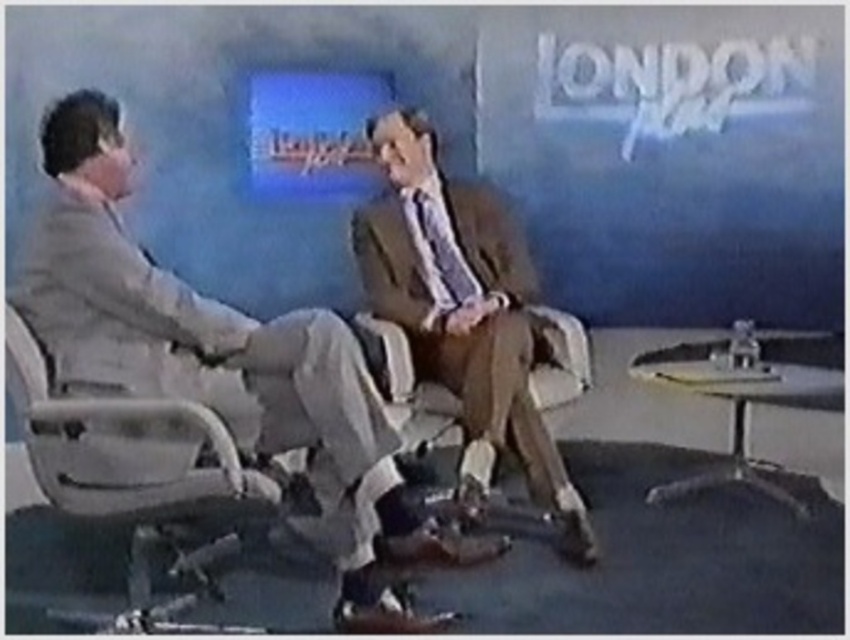
Question: Does brown leather suit at center appear on the left side of light gray plastic swivel chair at left?

Choices:
 (A) no
 (B) yes

Answer: (A)

Question: Considering the relative positions of matte gray suit at center and light gray plastic swivel chair at left in the image provided, where is matte gray suit at center located with respect to light gray plastic swivel chair at left?

Choices:
 (A) above
 (B) below

Answer: (B)

Question: Which object appears farthest from the camera in this image?

Choices:
 (A) brown leather suit at center
 (B) matte gray suit at center
 (C) light gray plastic swivel chair at left

Answer: (A)

Question: From the image, what is the correct spatial relationship of brown leather suit at center in relation to light gray plastic swivel chair at left?

Choices:
 (A) right
 (B) left

Answer: (A)

Question: Which object is positioned closest to the light gray plastic swivel chair at left?

Choices:
 (A) brown leather suit at center
 (B) matte gray suit at center

Answer: (B)

Question: Which of the following is the farthest from the observer?

Choices:
 (A) (26, 444)
 (B) (86, 115)
 (C) (479, 273)

Answer: (C)